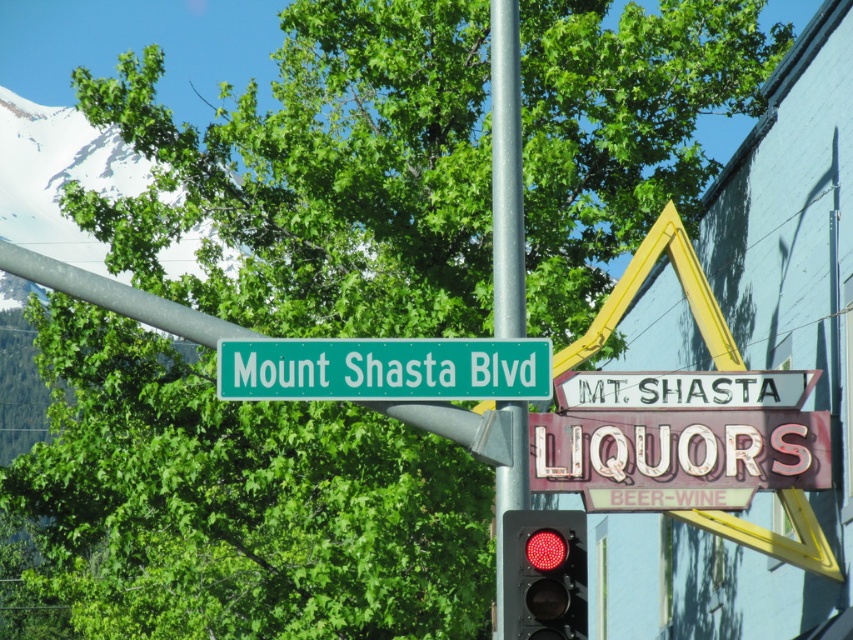
Question: Estimate the real-world distances between objects in this image. Which object is closer to the metallic pole at center?

Choices:
 (A) red glass traffic light at center
 (B) green metallic street sign at upper center

Answer: (B)

Question: Is metallic pole at center to the right of red glass traffic light at center from the viewer's perspective?

Choices:
 (A) yes
 (B) no

Answer: (B)

Question: Considering the real-world distances, which object is farthest from the red glass traffic light at center?

Choices:
 (A) metallic pole at center
 (B) green metallic street sign at upper center

Answer: (A)

Question: In this image, where is metallic pole at center located relative to red glass traffic light at center?

Choices:
 (A) left
 (B) right

Answer: (A)

Question: Which of the following is the farthest from the observer?

Choices:
 (A) (408, 392)
 (B) (503, 205)

Answer: (B)

Question: Does metallic pole at center appear on the left side of red glass traffic light at center?

Choices:
 (A) no
 (B) yes

Answer: (B)